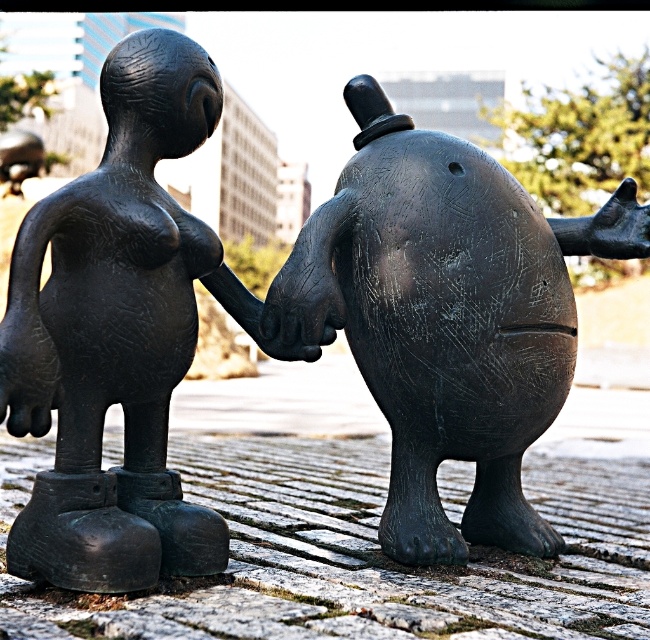
You are a maintenance worker standing 1.5 meters away from the matte black sculpture at center. You need to clean the sculpture but have a spray bottle with a maximum range of 1.5 meters. Can you reach the sculpture without moving closer?

The matte black sculpture at center is 1.22 meters away from the viewer. Since the spray bottle has a maximum range of 1.5 meters, you can reach the sculpture without moving closer.

You are an urban planner assessing the placement of the matte black sculpture at center in a public square. The square has a coordinate grid where the bottom left corner is the origin point. Based on the sculpture location at point 0.497, 0.688, is it closer to the center of the square or to the edge?

The matte black sculpture at center is located at coordinates (447,317). Since both coordinates are close to 0.5, which represents the center of the square, the sculpture is closer to the center than the edge.

You are an art curator planning to move the matte black sculpture at center and the matte black statue at center into a new exhibition space. The entrance has a doorway that is 1.2 meters wide. Can both objects pass through the doorway if placed side by side horizontally?

The matte black sculpture at center is wider than the matte black statue at center. Since the doorway is 1.2 meters wide, we need to know the combined width of both objects to determine if they can fit side by side. However, the exact widths are not provided in the scene description. Therefore, it is impossible to confirm if they can pass through the doorway based on the given information.